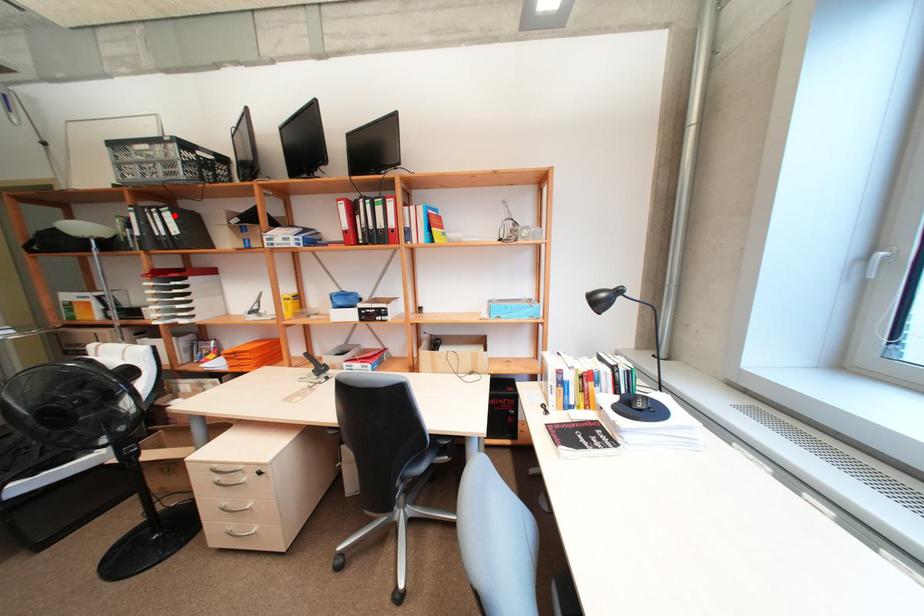
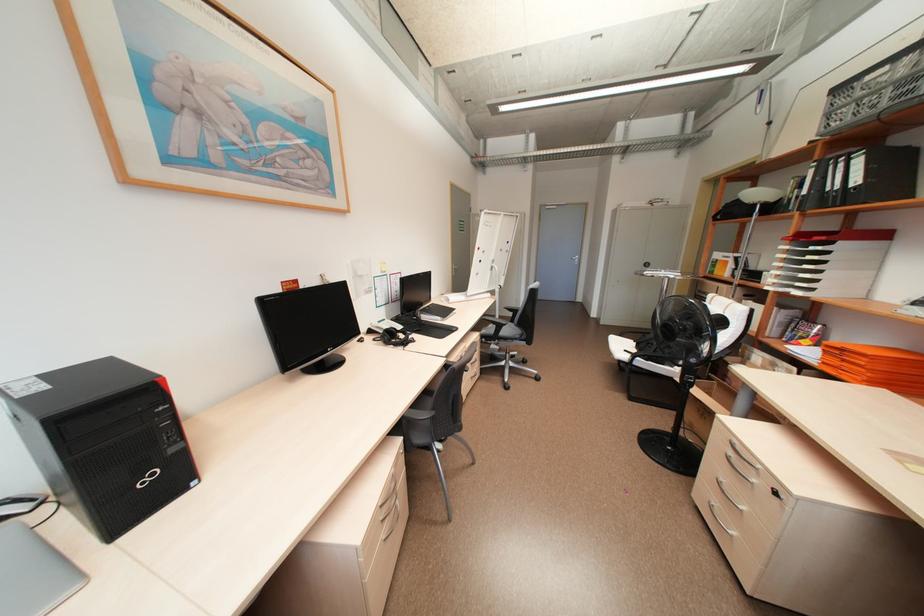
The point at the highlighted location is marked in the first image. Where is the corresponding point in the second image?

(865, 161)